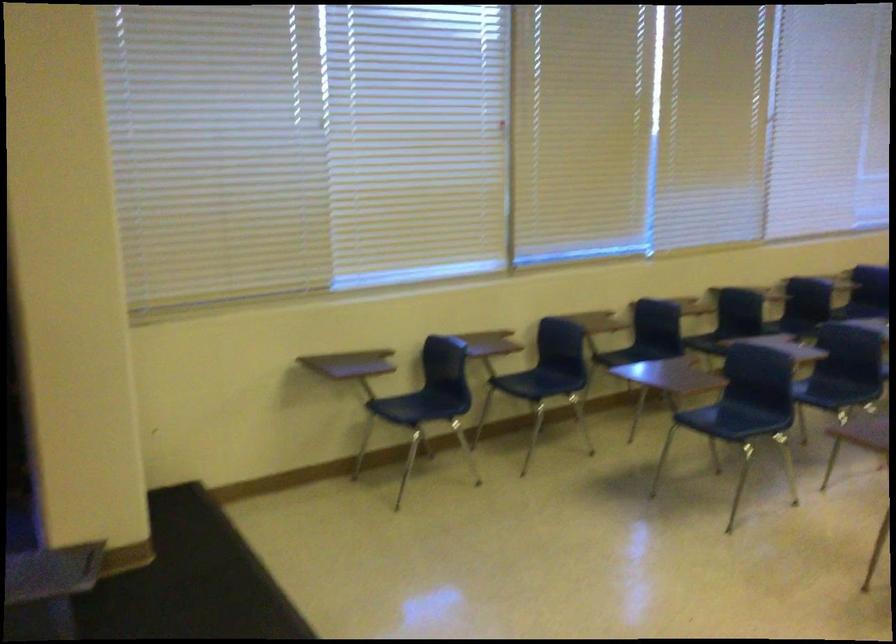
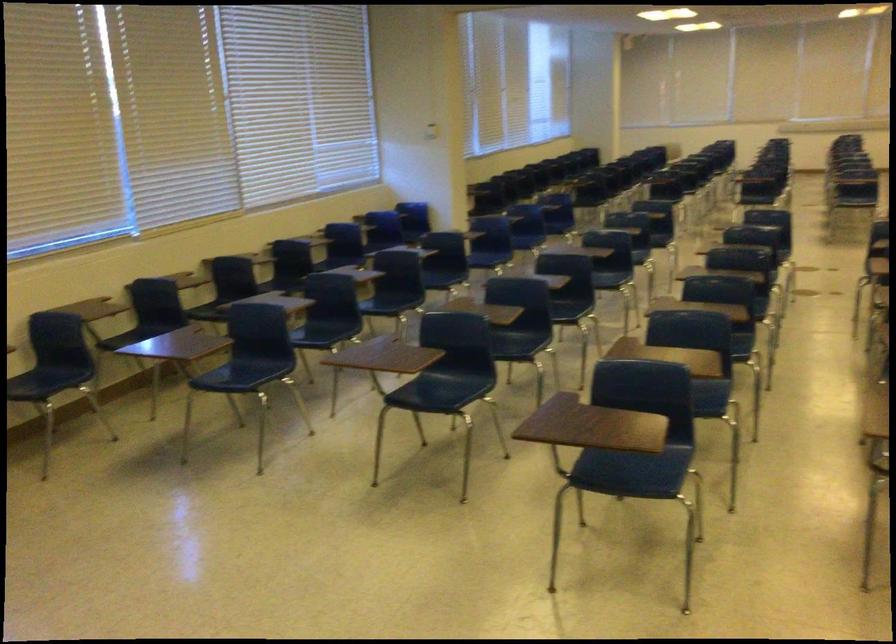
Question: How did the camera likely rotate?

Choices:
 (A) Left
 (B) Right
 (C) Up
 (D) Down

Answer: (B)